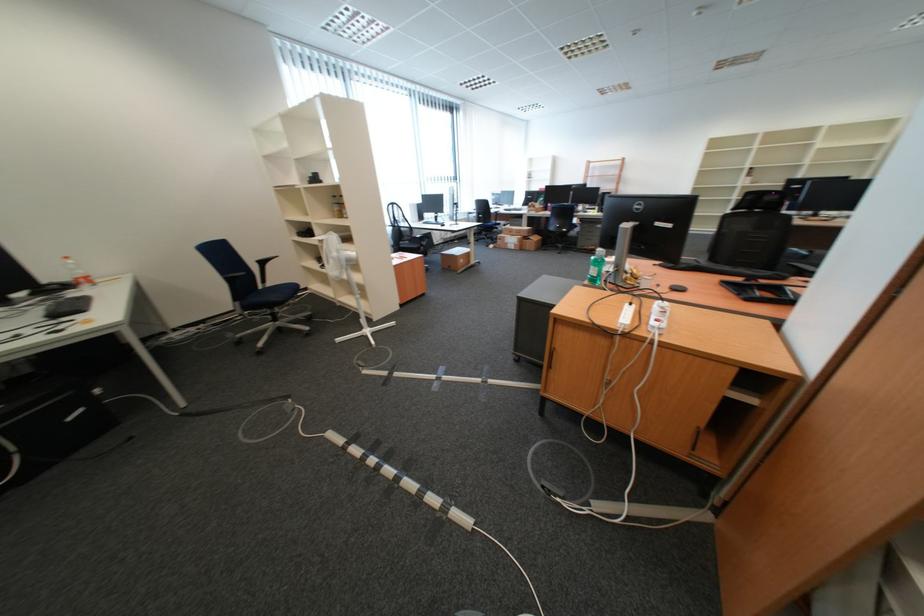
This screenshot has height=616, width=924. In order to click on black keyboard in this screenshot , I will do `click(761, 292)`.